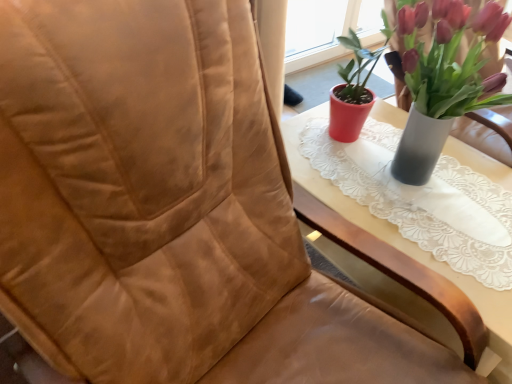
Find the location of a particular element. Image resolution: width=512 pixels, height=384 pixels. vacant point above wooden table at center (from a real-world perspective) is located at coordinates (408, 183).